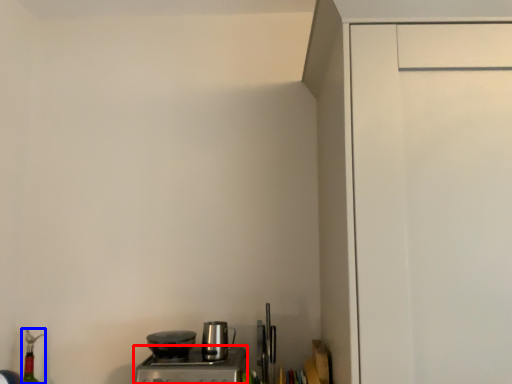
Question: Which point is further to the camera, home appliance (highlighted by a red box) or bottle (highlighted by a blue box)?

Choices:
 (A) home appliance
 (B) bottle

Answer: (B)